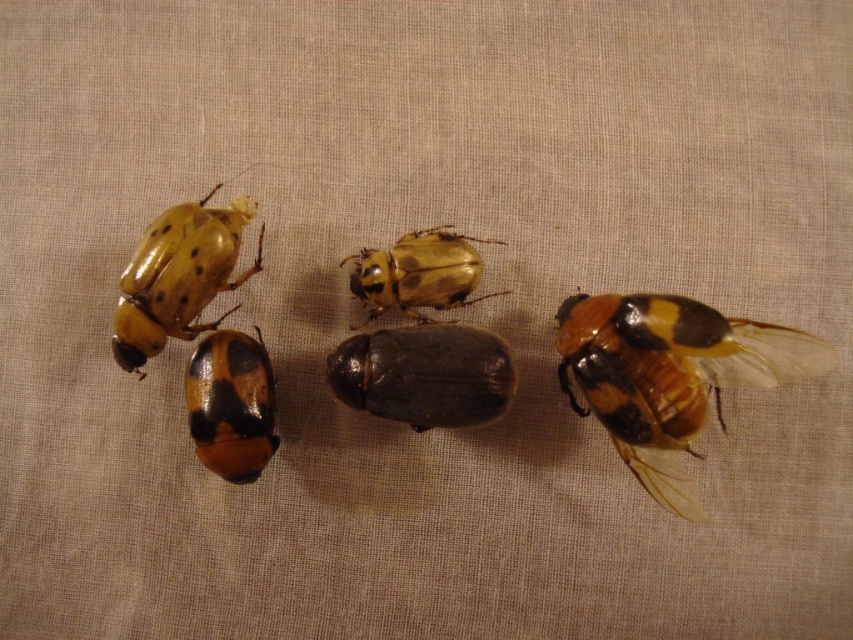
Can you confirm if matte yellow beetle at upper left is positioned to the right of matte black beetle at center?

No, matte yellow beetle at upper left is not to the right of matte black beetle at center.

Where is `matte yellow beetle at upper left`? matte yellow beetle at upper left is located at coordinates 178,276.

Between point (187, 304) and point (270, 449), which one is positioned behind?

The point (270, 449) is behind.

Find the location of a particular element. matte yellow beetle at upper left is located at coordinates (178, 276).

Between point (662, 346) and point (390, 272), which one is positioned behind?

Point (390, 272)

Between brown matte beetle at center and matte yellow beetle at center, which one appears on the left side from the viewer's perspective?

From the viewer's perspective, matte yellow beetle at center appears more on the left side.

Find the location of `brown matte beetle at center`. brown matte beetle at center is located at coordinates (669, 372).

Can you confirm if matte yellow beetle at upper left is positioned above matte yellow beetle at center?

Actually, matte yellow beetle at upper left is below matte yellow beetle at center.

The image size is (853, 640). What are the coordinates of `matte yellow beetle at upper left` in the screenshot? It's located at (178, 276).

Locate an element on the screen. matte yellow beetle at upper left is located at coordinates (178, 276).